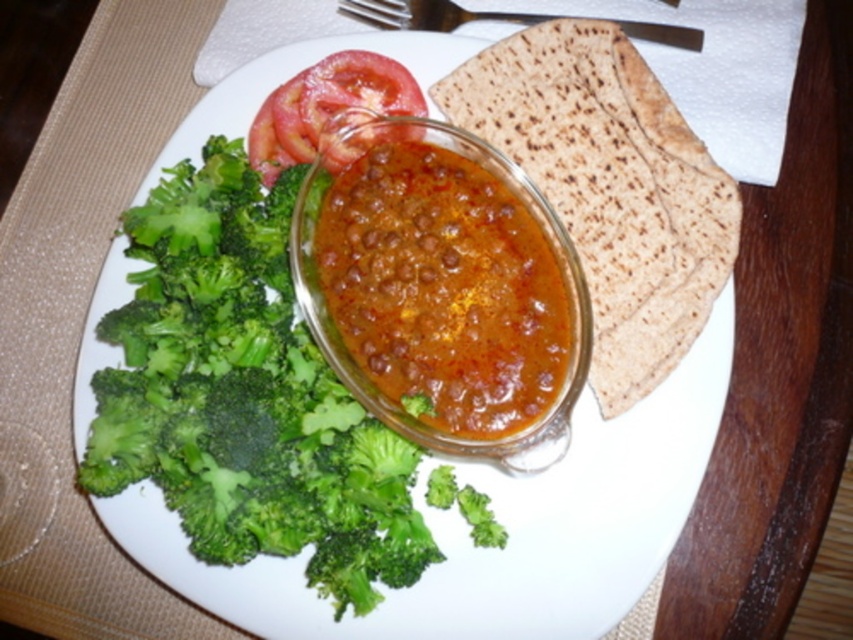
You are looking at the broccoli and tomato slices on the plate. Which of the two points, point (677,291) or point (424,22), is closer to you?

Point (677,291) is closer to the viewer than point (424,22).

You are standing 30 inches away from the plate. Is the point at point (297, 134) on the plate closer to you than the edge of the plate?

The distance of point (297, 134) from camera is 31.38 inches. Since you are standing 30 inches away from the plate, the point is farther away than your current position, so the point is not closer to you than the edge of the plate.